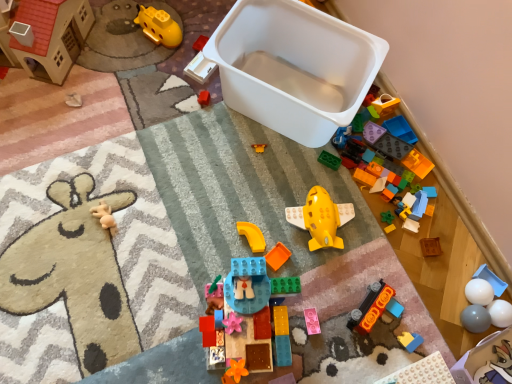
Find the location of a particular element. The height and width of the screenshot is (384, 512). vacant area that lies between white plastic storage box at upper center, which appears as the first storage box when viewed from the top, and cardboard house at upper left, which is the sixteenth toy in right-to-left order is located at coordinates (154, 91).